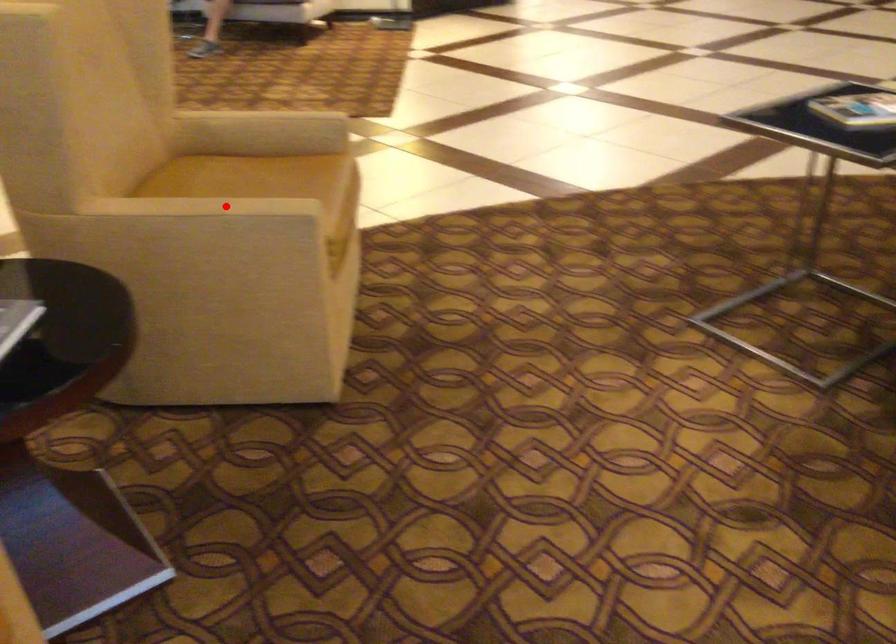
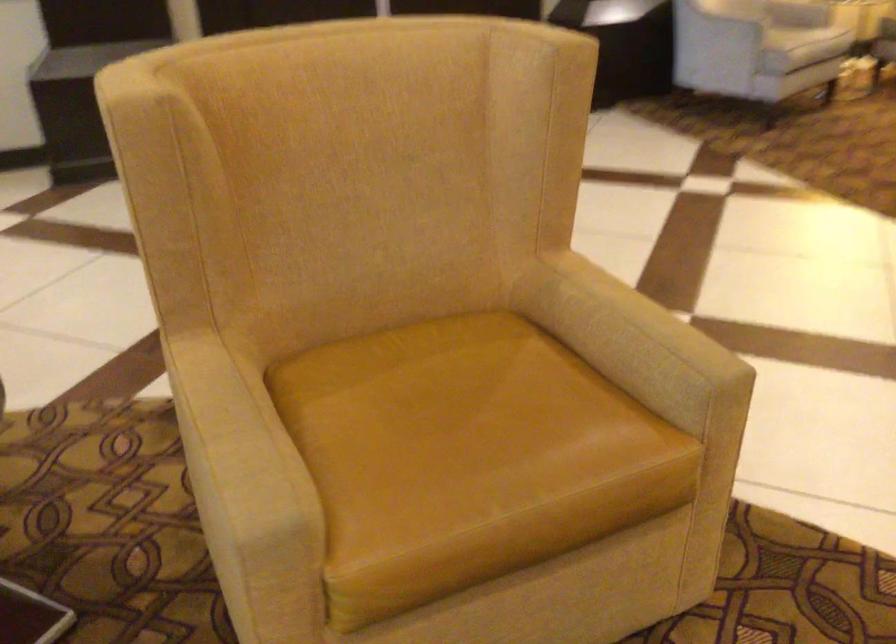
In the second image, find the point that corresponds to the highlighted location in the first image.

(235, 435)